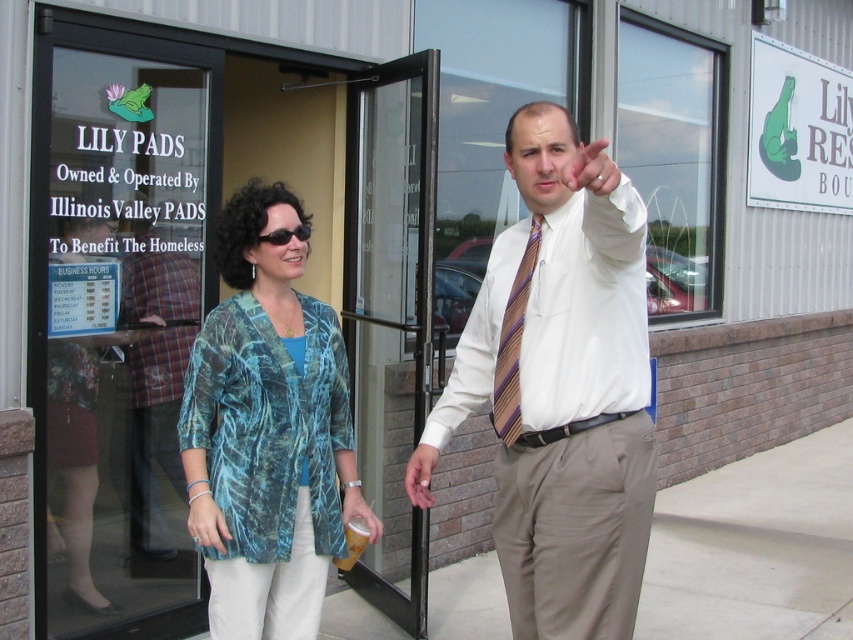
Question: Which of the following is the closest to the observer?

Choices:
 (A) transparent glass door at upper left
 (B) plaid shirt at center

Answer: (A)

Question: Among these objects, which one is nearest to the camera?

Choices:
 (A) plaid shirt at center
 (B) khaki cotton pants at right
 (C) teal printed blouse at center
 (D) transparent glass door at center

Answer: (B)

Question: Is khaki cotton pants at right thinner than plaid shirt at center?

Choices:
 (A) no
 (B) yes

Answer: (B)

Question: Estimate the real-world distances between objects in this image. Which object is farther from the transparent glass door at upper left?

Choices:
 (A) black plastic sunglasses at center
 (B) skinny striped tie at upper center

Answer: (B)

Question: Can you confirm if khaki cotton pants at right is positioned to the right of black plastic sunglasses at center?

Choices:
 (A) no
 (B) yes

Answer: (B)

Question: Does white striped tie at center have a lesser width compared to brown striped tie at center?

Choices:
 (A) yes
 (B) no

Answer: (B)